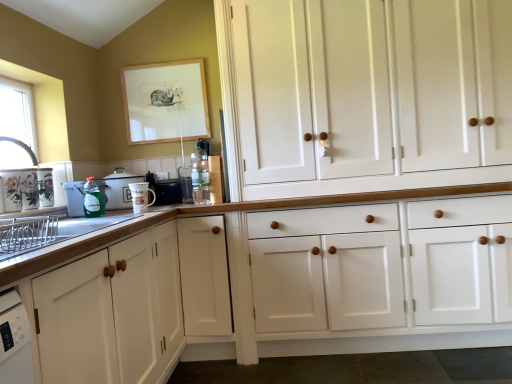
Question: Is porcelain floral mugs at left, placed as the 1th appliance when sorted from left to right, facing towards green plastic dish soap at left, which is the 2th appliance from left to right?

Choices:
 (A) no
 (B) yes

Answer: (B)

Question: From the image's perspective, does porcelain floral mugs at left, placed as the 1th appliance when sorted from left to right, appear higher than green plastic dish soap at left, which is the 2th appliance from left to right?

Choices:
 (A) no
 (B) yes

Answer: (B)

Question: Is green plastic dish soap at left, acting as the 5th appliance starting from the right, completely or partially inside porcelain floral mugs at left, placed as the 1th appliance when sorted from left to right?

Choices:
 (A) no
 (B) yes

Answer: (A)

Question: Can you confirm if porcelain floral mugs at left, placed as the 1th appliance when sorted from left to right, is smaller than green plastic dish soap at left, acting as the 5th appliance starting from the right?

Choices:
 (A) yes
 (B) no

Answer: (A)

Question: Does porcelain floral mugs at left, placed as the 1th appliance when sorted from left to right, appear on the left side of green plastic dish soap at left, acting as the 5th appliance starting from the right?

Choices:
 (A) no
 (B) yes

Answer: (B)

Question: Considering the relative positions of porcelain floral mugs at left, placed as the 1th appliance when sorted from left to right, and green plastic dish soap at left, acting as the 5th appliance starting from the right, in the image provided, is porcelain floral mugs at left, placed as the 1th appliance when sorted from left to right, to the right of green plastic dish soap at left, acting as the 5th appliance starting from the right, from the viewer's perspective?

Choices:
 (A) yes
 (B) no

Answer: (B)

Question: Is satin silver dish rack at left not close to translucent glass bottle at center, positioned as the second bottle in left-to-right order?

Choices:
 (A) yes
 (B) no

Answer: (B)

Question: Is satin silver dish rack at left not inside translucent glass bottle at center, arranged as the second bottle when viewed from the front?

Choices:
 (A) yes
 (B) no

Answer: (A)

Question: Is satin silver dish rack at left to the left of translucent glass bottle at center, positioned as the second bottle in left-to-right order, from the viewer's perspective?

Choices:
 (A) no
 (B) yes

Answer: (B)

Question: Is satin silver dish rack at left smaller than translucent glass bottle at center, positioned as the second bottle in left-to-right order?

Choices:
 (A) yes
 (B) no

Answer: (B)

Question: Is the position of satin silver dish rack at left less distant than that of translucent glass bottle at center, positioned as the second bottle in left-to-right order?

Choices:
 (A) no
 (B) yes

Answer: (B)

Question: Is satin silver dish rack at left positioned with its back to translucent glass bottle at center, the first bottle from the back?

Choices:
 (A) yes
 (B) no

Answer: (B)

Question: Does porcelain floral mugs at left, the sixth appliance in the right-to-left sequence, have a greater height compared to white glossy cabinet at lower left, which ranks as the 1th cabinetry in left-to-right order?

Choices:
 (A) yes
 (B) no

Answer: (B)